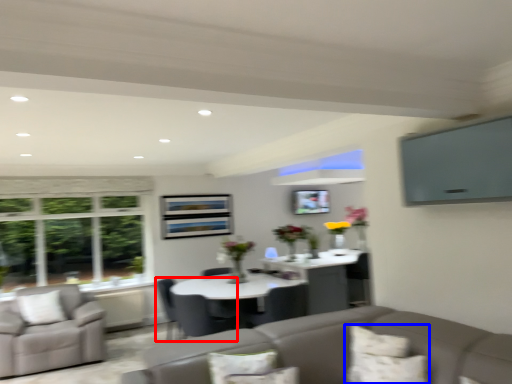
Question: Among these objects, which one is farthest to the camera, chair (highlighted by a red box) or pillow (highlighted by a blue box)?

Choices:
 (A) chair
 (B) pillow

Answer: (A)